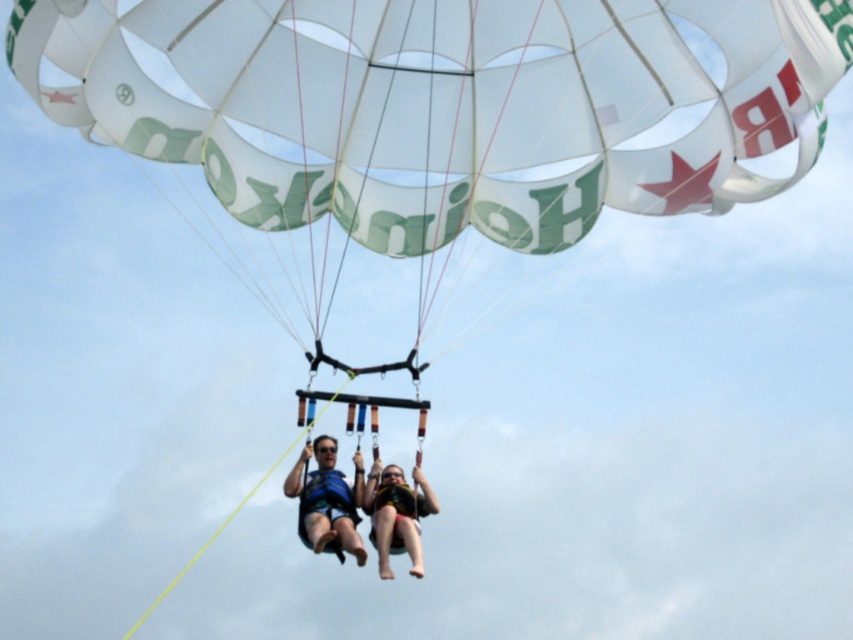
Question: Does black life vest at center appear over matte yellow life vest at center?

Choices:
 (A) yes
 (B) no

Answer: (A)

Question: Does blue life vest at center appear on the right side of matte yellow life vest at center?

Choices:
 (A) yes
 (B) no

Answer: (B)

Question: Based on their relative distances, which object is nearer to the blue life vest at center?

Choices:
 (A) matte yellow life vest at center
 (B) black life vest at center

Answer: (B)

Question: Which point appears farthest from the camera in this image?

Choices:
 (A) (302, 458)
 (B) (374, 476)

Answer: (A)

Question: Among these points, which one is nearest to the camera?

Choices:
 (A) (346, 500)
 (B) (434, 512)
 (C) (312, 540)

Answer: (C)

Question: In this image, where is blue life vest at center located relative to matte yellow life vest at center?

Choices:
 (A) below
 (B) above

Answer: (B)